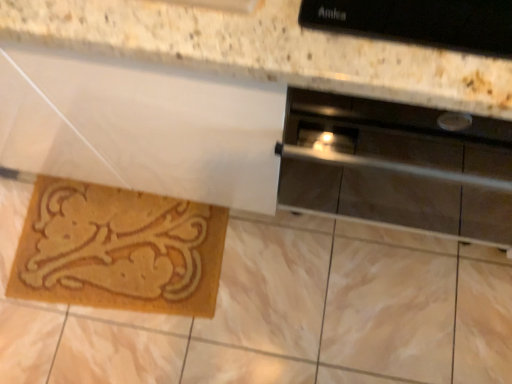
Question: From a real-world perspective, is stainless steel oven at right on natural fiber mat at lower left?

Choices:
 (A) yes
 (B) no

Answer: (A)

Question: Does stainless steel oven at right have a lesser width compared to natural fiber mat at lower left?

Choices:
 (A) no
 (B) yes

Answer: (A)

Question: Is stainless steel oven at right directly adjacent to natural fiber mat at lower left?

Choices:
 (A) no
 (B) yes

Answer: (A)

Question: Is there a large distance between stainless steel oven at right and natural fiber mat at lower left?

Choices:
 (A) yes
 (B) no

Answer: (B)

Question: Is stainless steel oven at right positioned with its back to natural fiber mat at lower left?

Choices:
 (A) no
 (B) yes

Answer: (A)

Question: Does stainless steel oven at right contain natural fiber mat at lower left?

Choices:
 (A) no
 (B) yes

Answer: (A)

Question: Can you confirm if natural fiber mat at lower left is bigger than stainless steel oven at right?

Choices:
 (A) yes
 (B) no

Answer: (B)

Question: From a real-world perspective, is natural fiber mat at lower left beneath stainless steel oven at right?

Choices:
 (A) no
 (B) yes

Answer: (B)

Question: From a real-world perspective, does natural fiber mat at lower left stand above stainless steel oven at right?

Choices:
 (A) yes
 (B) no

Answer: (B)

Question: Considering the relative sizes of natural fiber mat at lower left and stainless steel oven at right in the image provided, is natural fiber mat at lower left taller than stainless steel oven at right?

Choices:
 (A) no
 (B) yes

Answer: (A)

Question: Is natural fiber mat at lower left to the left of stainless steel oven at right from the viewer's perspective?

Choices:
 (A) no
 (B) yes

Answer: (B)

Question: Can you confirm if natural fiber mat at lower left is shorter than stainless steel oven at right?

Choices:
 (A) yes
 (B) no

Answer: (A)

Question: Based on their positions, is stainless steel oven at right located to the left or right of natural fiber mat at lower left?

Choices:
 (A) left
 (B) right

Answer: (B)